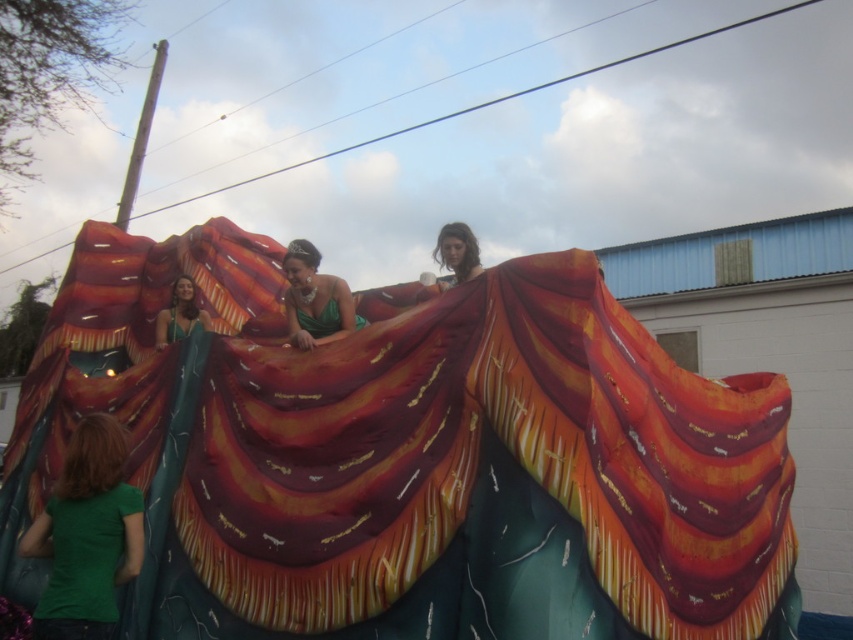
Looking at this image, you are a photographer trying to capture the float from the front. You notice two elements on the float, the shiny metallic blanket at center and the matte green fabric at upper center. Which one will appear larger in your photo?

The shiny metallic blanket at center will appear larger in your photo because it is closer to the viewer than the matte green fabric at upper center.

You are a photographer trying to capture both the green matte shirt at lower left and the green satin dress at upper left in the same frame. Which object should you focus on first to ensure both are visible without moving the camera?

You should focus on the green matte shirt at lower left first because it is wider than the green satin dress at upper left, so capturing it first ensures the narrower dress will also be in frame.